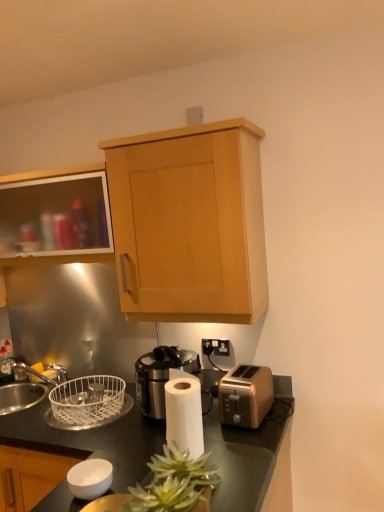
Where is `brushed metal faucet at left`? This screenshot has width=384, height=512. brushed metal faucet at left is located at coordinates (35, 373).

Describe the element at coordinates (54, 218) in the screenshot. The image size is (384, 512). I see `matte glass cabinet at upper left, which ranks as the 2th cabinetry in right-to-left order` at that location.

Where is `matte glass cabinet at upper left, which appears as the first cabinetry when viewed from the left`? The image size is (384, 512). matte glass cabinet at upper left, which appears as the first cabinetry when viewed from the left is located at coordinates 54,218.

What do you see at coordinates (161, 376) in the screenshot? This screenshot has width=384, height=512. I see `black metallic coffee machine at center` at bounding box center [161, 376].

The width and height of the screenshot is (384, 512). I want to click on black plastic electrical outlet at center, so click(x=215, y=347).

Considering the positions of objects gold metallic toaster at lower right and brushed metal faucet at left in the image provided, who is more to the left, gold metallic toaster at lower right or brushed metal faucet at left?

brushed metal faucet at left is more to the left.

Which object is further away from the camera taking this photo, gold metallic toaster at lower right or brushed metal faucet at left?

brushed metal faucet at left is further away from the camera.

Considering the sizes of objects gold metallic toaster at lower right and brushed metal faucet at left in the image provided, who is taller, gold metallic toaster at lower right or brushed metal faucet at left?

With more height is gold metallic toaster at lower right.

From the image's perspective, who appears lower, gold metallic toaster at lower right or brushed metal faucet at left?

brushed metal faucet at left.

Is white wire basket at lower left positioned far away from green leafy plant at center?

That's right, there is a large distance between white wire basket at lower left and green leafy plant at center.

From the image's perspective, is white wire basket at lower left positioned above or below green leafy plant at center?

From the image's perspective, white wire basket at lower left appears below green leafy plant at center.

Does white wire basket at lower left have a larger size compared to green leafy plant at center?

Indeed, white wire basket at lower left has a larger size compared to green leafy plant at center.

Could you tell me if white wire basket at lower left is turned towards green leafy plant at center?

No.

Which object is wider, white wire basket at lower left or brushed metal faucet at left?

white wire basket at lower left is wider.

Considering the sizes of objects white wire basket at lower left and brushed metal faucet at left in the image provided, who is shorter, white wire basket at lower left or brushed metal faucet at left?

white wire basket at lower left.

Where is `faucet below the white wire basket at lower left (from a real-world perspective)`? faucet below the white wire basket at lower left (from a real-world perspective) is located at coordinates 35,373.

How different are the orientations of black metallic coffee machine at center and green leafy plant at center in degrees?

There is a 60.6-degree angle between the facing directions of black metallic coffee machine at center and green leafy plant at center.

Is black metallic coffee machine at center positioned in front of green leafy plant at center?

No.

From the image's perspective, does black metallic coffee machine at center appear higher than green leafy plant at center?

Actually, black metallic coffee machine at center appears below green leafy plant at center in the image.

From the picture: Is black metallic coffee machine at center with green leafy plant at center?

No, black metallic coffee machine at center is not touching green leafy plant at center.

Is green leafy plant at center at the back of brushed metal faucet at left?

No, green leafy plant at center is not at the back of brushed metal faucet at left.

Who is taller, brushed metal faucet at left or green leafy plant at center?

With more height is green leafy plant at center.

Is brushed metal faucet at left not near green leafy plant at center?

Indeed, brushed metal faucet at left is not near green leafy plant at center.

Are matte glass cabinet at upper left, which ranks as the 2th cabinetry in right-to-left order, and brushed metal faucet at left making contact?

matte glass cabinet at upper left, which ranks as the 2th cabinetry in right-to-left order, is not next to brushed metal faucet at left, and they're not touching.

Which is more to the right, matte glass cabinet at upper left, which appears as the first cabinetry when viewed from the left, or brushed metal faucet at left?

matte glass cabinet at upper left, which appears as the first cabinetry when viewed from the left, is more to the right.

Considering the relative sizes of matte glass cabinet at upper left, which ranks as the 2th cabinetry in right-to-left order, and brushed metal faucet at left in the image provided, is matte glass cabinet at upper left, which ranks as the 2th cabinetry in right-to-left order, wider than brushed metal faucet at left?

Yes.

Does matte glass cabinet at upper left, which ranks as the 2th cabinetry in right-to-left order, have a smaller size compared to brushed metal faucet at left?

No.

Locate an element on the screen. This screenshot has width=384, height=512. plant that is above the gold metallic toaster at lower right (from a real-world perspective) is located at coordinates (173, 482).

Is gold metallic toaster at lower right at the left side of green leafy plant at center?

Incorrect, gold metallic toaster at lower right is not on the left side of green leafy plant at center.

Where is `toaster that appears on the right of brushed metal faucet at left`? toaster that appears on the right of brushed metal faucet at left is located at coordinates (245, 395).

The height and width of the screenshot is (512, 384). What are the coordinates of `plant lying above the white wire basket at lower left (from the image's perspective)` in the screenshot? It's located at (173, 482).

Considering their positions, is gold metallic toaster at lower right positioned further to black plastic electrical outlet at center than black metallic coffee machine at center?

gold metallic toaster at lower right lies further to black plastic electrical outlet at center than the other object.

From the image, which object appears to be nearer to green leafy plant at center, gold metallic toaster at lower right or brushed metal faucet at left?

The object closer to green leafy plant at center is gold metallic toaster at lower right.

Which object lies nearer to the anchor point white wire basket at lower left, black plastic electrical outlet at center or gold metallic toaster at lower right?

black plastic electrical outlet at center lies closer to white wire basket at lower left than the other object.

Based on their spatial positions, is black plastic electrical outlet at center or white wire basket at lower left closer to black glossy countertop at center?

The object closer to black glossy countertop at center is white wire basket at lower left.

From the image, which object appears to be farther from black plastic electrical outlet at center, gold metallic toaster at lower right or matte glass cabinet at upper left, which appears as the first cabinetry when viewed from the left?

Based on the image, matte glass cabinet at upper left, which appears as the first cabinetry when viewed from the left, appears to be further to black plastic electrical outlet at center.

Which object lies nearer to the anchor point green leafy plant at center, light wood cabinet at upper center, the 1th cabinetry positioned from the right, or black metallic coffee machine at center?

black metallic coffee machine at center lies closer to green leafy plant at center than the other object.

Estimate the real-world distances between objects in this image. Which object is closer to matte glass cabinet at upper left, which ranks as the 2th cabinetry in right-to-left order, white wire basket at lower left or gold metallic toaster at lower right?

Among the two, white wire basket at lower left is located nearer to matte glass cabinet at upper left, which ranks as the 2th cabinetry in right-to-left order.

Which object lies further to the anchor point light wood cabinet at upper center, the 1th cabinetry positioned from the right, green leafy plant at center or black plastic electrical outlet at center?

green leafy plant at center lies further to light wood cabinet at upper center, the 1th cabinetry positioned from the right, than the other object.

Where is `coffee machine between brushed metal faucet at left and gold metallic toaster at lower right in the horizontal direction`? The width and height of the screenshot is (384, 512). coffee machine between brushed metal faucet at left and gold metallic toaster at lower right in the horizontal direction is located at coordinates (161, 376).

Where is `coffee machine between black glossy countertop at center and brushed metal faucet at left along the z-axis`? coffee machine between black glossy countertop at center and brushed metal faucet at left along the z-axis is located at coordinates (161, 376).

This screenshot has height=512, width=384. In order to click on basket between matte glass cabinet at upper left, which ranks as the 2th cabinetry in right-to-left order, and black glossy countertop at center from top to bottom in this screenshot , I will do `click(86, 402)`.

This screenshot has width=384, height=512. In order to click on cabinetry between matte glass cabinet at upper left, which appears as the first cabinetry when viewed from the left, and white wire basket at lower left in the up-down direction in this screenshot , I will do `click(189, 223)`.